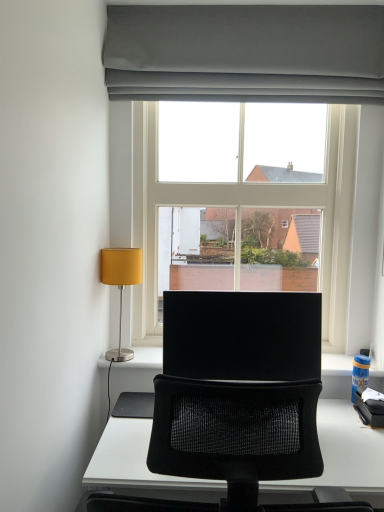
Question: Does clear glass window at center contain matte yellow fabric lampshade at left?

Choices:
 (A) no
 (B) yes

Answer: (A)

Question: From the image's perspective, would you say clear glass window at center is shown under matte yellow fabric lampshade at left?

Choices:
 (A) no
 (B) yes

Answer: (A)

Question: Would you say clear glass window at center is a long distance from matte yellow fabric lampshade at left?

Choices:
 (A) yes
 (B) no

Answer: (B)

Question: Is clear glass window at center outside matte yellow fabric lampshade at left?

Choices:
 (A) no
 (B) yes

Answer: (B)

Question: Is clear glass window at center shorter than matte yellow fabric lampshade at left?

Choices:
 (A) yes
 (B) no

Answer: (B)

Question: Is clear glass window at center positioned before matte yellow fabric lampshade at left?

Choices:
 (A) yes
 (B) no

Answer: (B)

Question: Is matte yellow fabric lampshade at left at the right side of black matte computer monitor at center?

Choices:
 (A) no
 (B) yes

Answer: (A)

Question: Does matte yellow fabric lampshade at left turn towards black matte computer monitor at center?

Choices:
 (A) no
 (B) yes

Answer: (A)

Question: Are matte yellow fabric lampshade at left and black matte computer monitor at center making contact?

Choices:
 (A) no
 (B) yes

Answer: (A)

Question: Does matte yellow fabric lampshade at left have a lesser width compared to black matte computer monitor at center?

Choices:
 (A) no
 (B) yes

Answer: (A)

Question: From the image's perspective, does matte yellow fabric lampshade at left appear higher than black matte computer monitor at center?

Choices:
 (A) no
 (B) yes

Answer: (B)

Question: Does matte yellow fabric lampshade at left appear on the left side of black matte computer monitor at center?

Choices:
 (A) yes
 (B) no

Answer: (A)

Question: Is matte gray curtain at upper center facing away from clear glass window at center?

Choices:
 (A) yes
 (B) no

Answer: (B)